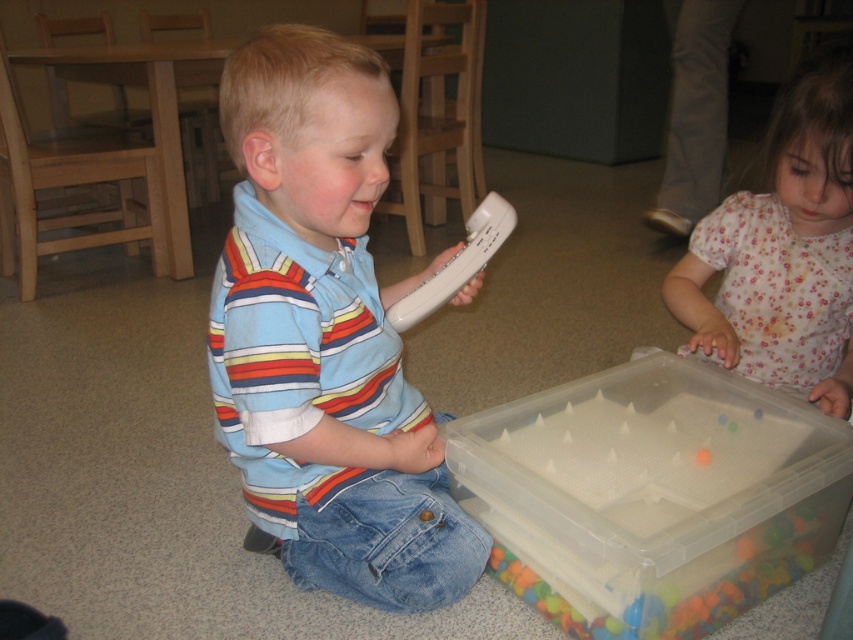
Can you confirm if clear plastic container at lower right is positioned to the left of white plastic remote at center?

In fact, clear plastic container at lower right is to the right of white plastic remote at center.

This screenshot has height=640, width=853. Describe the element at coordinates (653, 496) in the screenshot. I see `clear plastic container at lower right` at that location.

Identify the location of clear plastic container at lower right. This screenshot has height=640, width=853. (653, 496).

Can you confirm if floral cotton shirt at lower right is bigger than white plastic remote at center?

Indeed, floral cotton shirt at lower right has a larger size compared to white plastic remote at center.

Can you confirm if floral cotton shirt at lower right is taller than white plastic remote at center?

Yes.

Where is `floral cotton shirt at lower right`? The image size is (853, 640). floral cotton shirt at lower right is located at coordinates (784, 250).

Does matte striped shirt at center come in front of clear plastic container at lower right?

Yes, matte striped shirt at center is closer to the viewer.

Between point (393, 572) and point (648, 378), which one is positioned behind?

Point (648, 378)

Is point (367, 97) more distant than point (554, 480)?

No, (367, 97) is closer to viewer.

At what (x,y) coordinates should I click in order to perform the action: click on matte striped shirt at center. Please return your answer as a coordinate pair (x, y). This screenshot has width=853, height=640. Looking at the image, I should click on (325, 336).